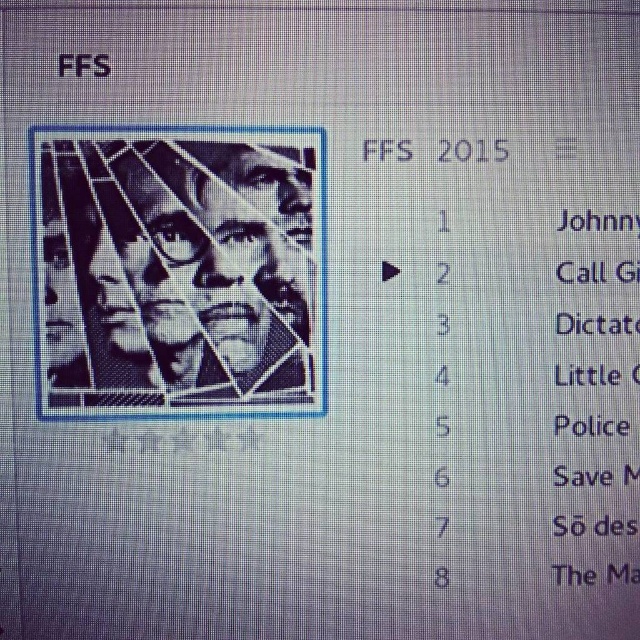
Between black matte face at center and black pixelated text at upper left, which one appears on the left side from the viewer's perspective?

black pixelated text at upper left

Who is positioned more to the right, black matte face at center or black pixelated text at upper left?

black matte face at center

The width and height of the screenshot is (640, 640). Describe the element at coordinates (177, 266) in the screenshot. I see `black matte face at center` at that location.

This screenshot has width=640, height=640. Identify the location of black matte face at center. (177, 266).